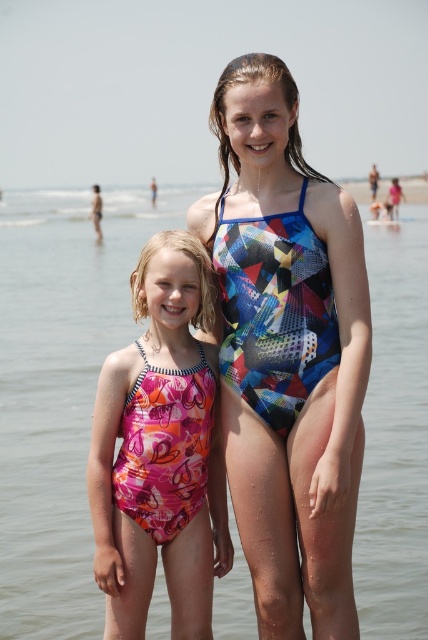
You are a photographer trying to capture the two girls in the scene. You want to ensure that both points, point (x=76, y=252) and point (x=267, y=400), are in focus. Which point should you focus on first to ensure the other is also in focus?

You should focus on point (x=76, y=252) first because it is closer to the viewer than point (x=267, y=400). By focusing on the closer point, the farther point will also be in focus due to the depth of field.

You are standing at the beach and want to take a photo of the point at coordinates point (x=383, y=320). If your camera has a maximum zoom range of 100 feet, will you be able to capture the point clearly in your photo?

The point at coordinates point (x=383, y=320) is 152.08 feet away from you. Since your camera can only zoom up to 100 feet, you will not be able to capture the point clearly in your photo.

You are a photographer trying to capture both the pink fabric swimsuit at center and the multicolored geometric swimsuit at center in a single shot. Which swimsuit will appear closer to the camera in the photo?

The pink fabric swimsuit at center will appear closer to the camera in the photo because it is further to the viewer than the multicolored geometric swimsuit at center.